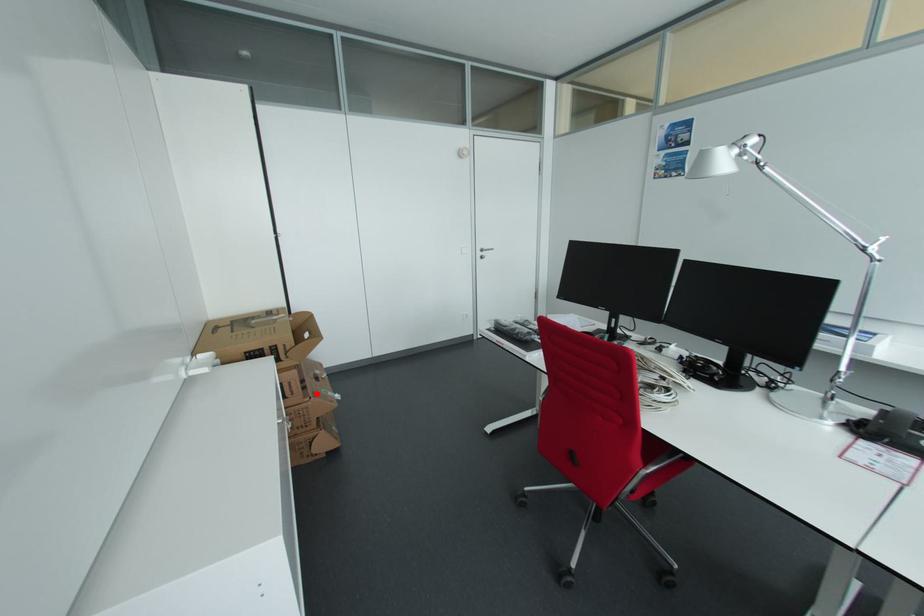
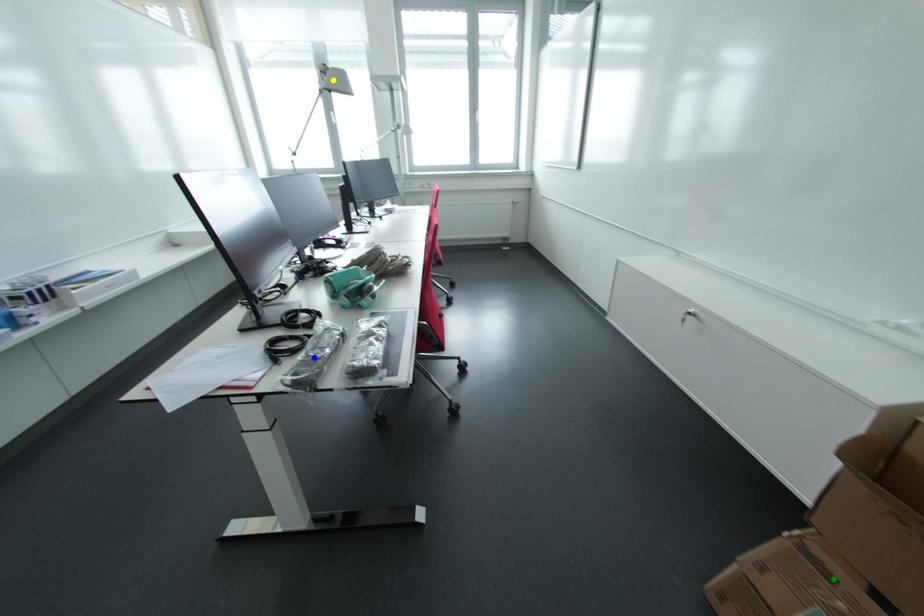
Question: I am providing you with two images of the same scene from different viewpoints. A red point is marked on the first image. You are given multiple points on the second image. Which point in image 2 is actually the same real-world point as the red point in image 1?

Choices:
 (A) yellow point
 (B) green point
 (C) blue point

Answer: (B)